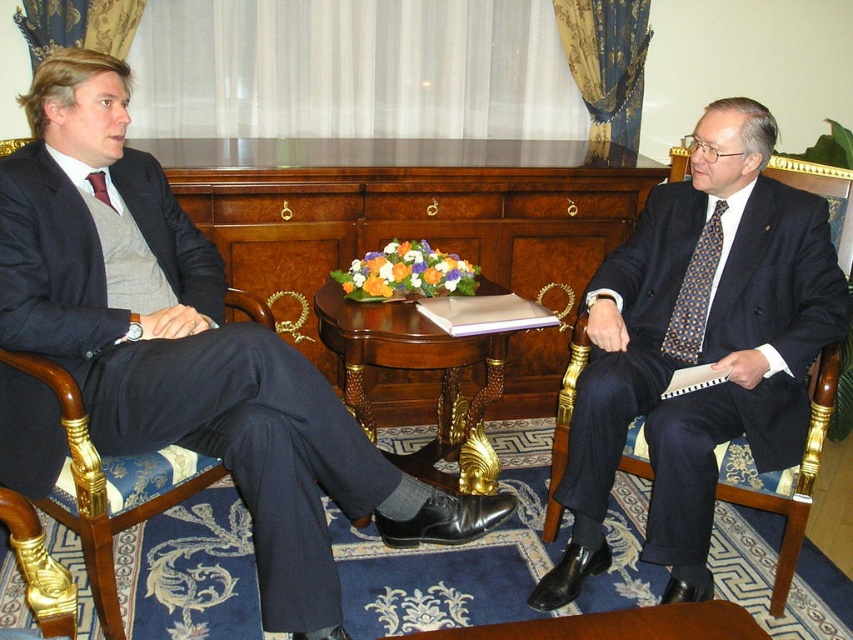
Question: Estimate the real-world distances between objects in this image. Which object is farther from the polka dot silk tie at right?

Choices:
 (A) woodenobject at center
 (B) matte black suit at left
 (C) polished dark blue suit at right
 (D) matte red tie at left

Answer: (D)

Question: Is polished dark blue suit at right smaller than matte red tie at left?

Choices:
 (A) no
 (B) yes

Answer: (A)

Question: Does polished dark blue suit at right have a lesser width compared to matte red tie at left?

Choices:
 (A) no
 (B) yes

Answer: (A)

Question: Which of these objects is positioned closest to the matte black suit at left?

Choices:
 (A) matte red tie at left
 (B) woodenobject at center

Answer: (A)

Question: Can you confirm if woodenobject at center is thinner than matte red tie at left?

Choices:
 (A) no
 (B) yes

Answer: (A)

Question: Which is farther from the matte red tie at left?

Choices:
 (A) woodenobject at center
 (B) polished dark blue suit at right
 (C) matte black suit at left

Answer: (B)